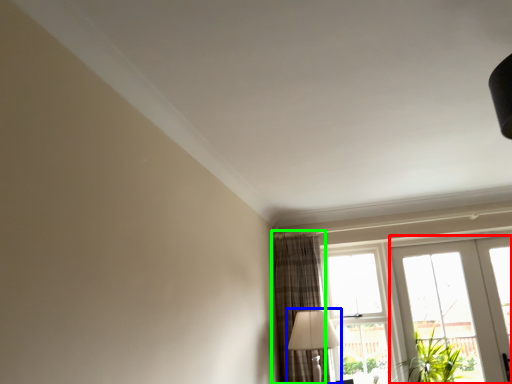
Question: Which object is positioned closest to door (highlighted by a red box)? Select from table lamp (highlighted by a blue box) and curtain (highlighted by a green box).

Choices:
 (A) table lamp
 (B) curtain

Answer: (B)